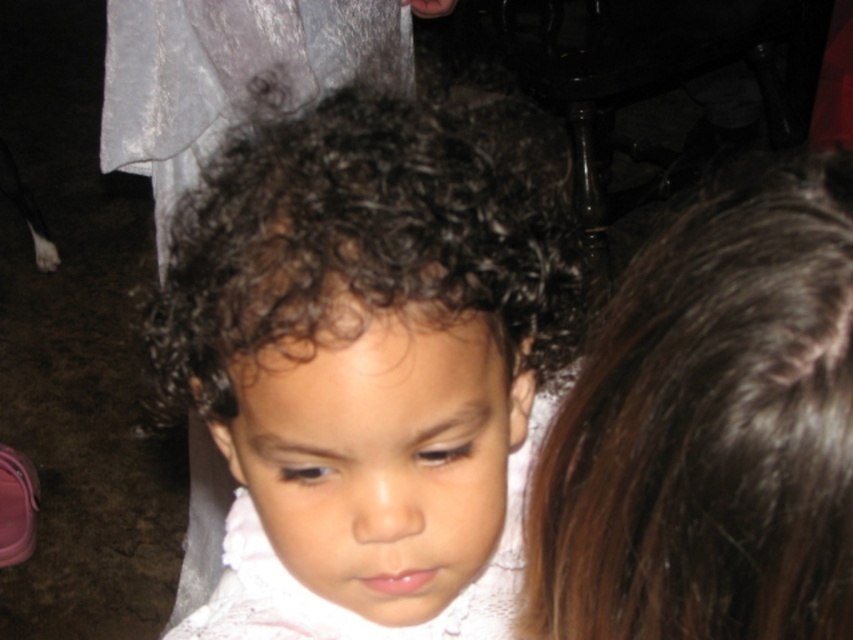
Who is positioned more to the left, dark curly hair at center or brown silky hair at upper right?

dark curly hair at center

Does dark curly hair at center appear under brown silky hair at upper right?

Indeed, dark curly hair at center is positioned under brown silky hair at upper right.

The height and width of the screenshot is (640, 853). Describe the element at coordinates (368, 340) in the screenshot. I see `dark curly hair at center` at that location.

The width and height of the screenshot is (853, 640). Find the location of `dark curly hair at center`. dark curly hair at center is located at coordinates (368, 340).

Who is higher up, brown silky hair at upper right or white lace dress at center?

brown silky hair at upper right is higher up.

Does brown silky hair at upper right have a larger size compared to white lace dress at center?

No, brown silky hair at upper right is not bigger than white lace dress at center.

Who is more forward, (819, 243) or (231, 604)?

Point (819, 243)

Where is `brown silky hair at upper right`? This screenshot has height=640, width=853. brown silky hair at upper right is located at coordinates (711, 428).

Can you confirm if dark curly hair at center is bigger than white lace dress at center?

Yes, dark curly hair at center is bigger than white lace dress at center.

Between dark curly hair at center and white lace dress at center, which one has less height?

With less height is white lace dress at center.

Image resolution: width=853 pixels, height=640 pixels. Describe the element at coordinates (368, 340) in the screenshot. I see `dark curly hair at center` at that location.

Locate an element on the screen. This screenshot has width=853, height=640. dark curly hair at center is located at coordinates (368, 340).